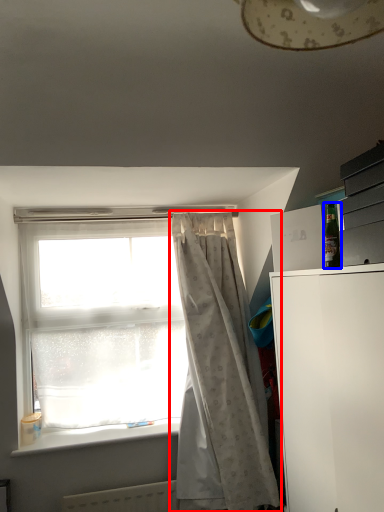
Question: Which object appears closest to the camera in this image, curtain (highlighted by a red box) or bottle (highlighted by a blue box)?

Choices:
 (A) curtain
 (B) bottle

Answer: (B)